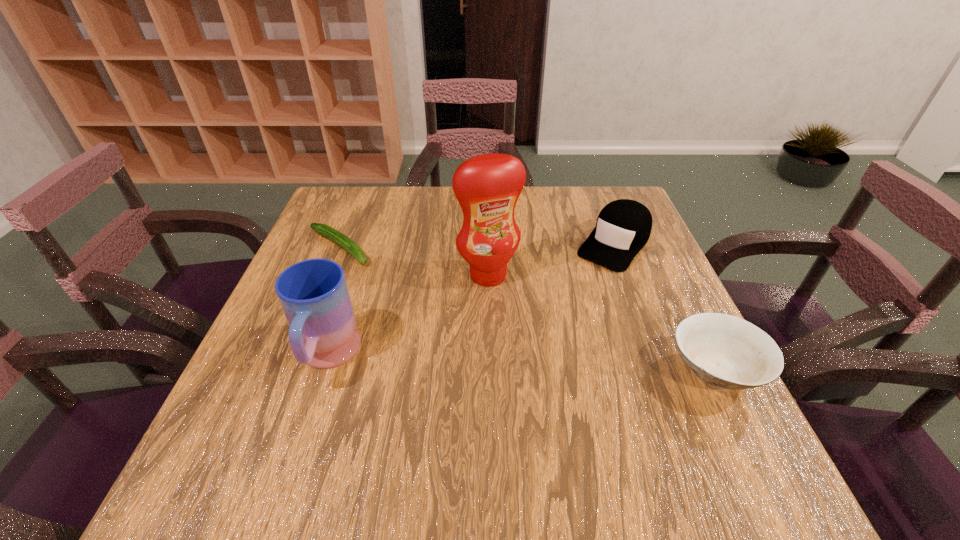
The width and height of the screenshot is (960, 540). I want to click on free spot between the condiment and the bowl, so click(602, 322).

Where is `vacant space that is in between the third object from left to right and the zucchini`? This screenshot has height=540, width=960. vacant space that is in between the third object from left to right and the zucchini is located at coordinates (414, 261).

Locate an element on the screen. The image size is (960, 540). vacant area that lies between the second tallest object and the second shortest object is located at coordinates (521, 363).

Locate an element on the screen. The width and height of the screenshot is (960, 540). the third closest object to the third tallest object is located at coordinates (313, 293).

Locate an element on the screen. This screenshot has height=540, width=960. object that is the closest to the condiment is located at coordinates (623, 227).

You are a GUI agent. You are given a task and a screenshot of the screen. Output one action in this format:
    pyautogui.click(x=<x>, y=<y>)
    Task: Click on the vacant space that satisfies the following two spatial constraints: 1. on the front side of the tallest object; 2. on the left side of the bowl
    
    Given the screenshot: What is the action you would take?
    pyautogui.click(x=491, y=370)

Identify the location of vacant area that satisfies the following two spatial constraints: 1. on the front side of the second shortest object; 2. on the left side of the tallest object. This screenshot has height=540, width=960. (491, 370).